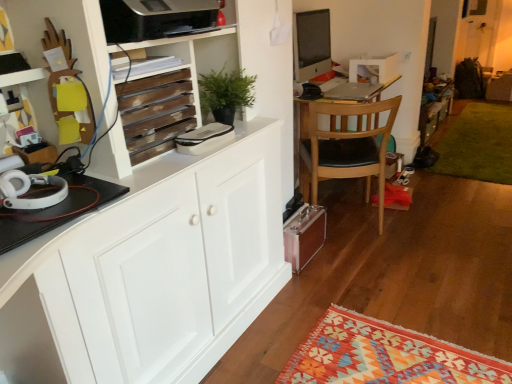
Image resolution: width=512 pixels, height=384 pixels. In order to click on vacant area situated below light brown wood chair at center (from a real-world perspective) in this screenshot , I will do `click(350, 224)`.